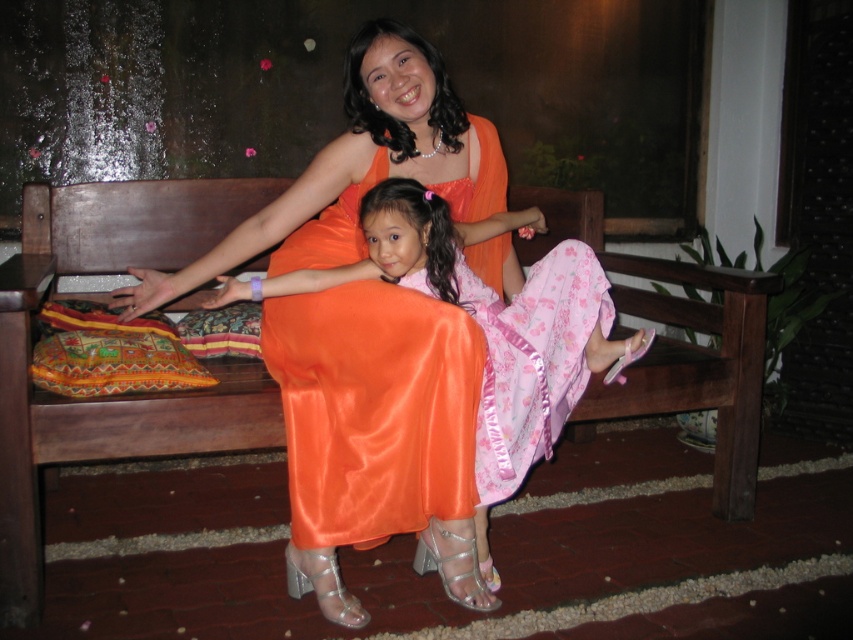
You are designing a stage for a play and need to place a prop that requires the same width as the wider object between the wooden bench at center and the shiny orange dress at center. Which object should you measure?

You should measure the wooden bench at center because it is wider than the shiny orange dress at center.

You are taking a photo of the scene and want to focus on both the point at point (x=715, y=269) and the point at point (x=456, y=337). Which point is closer to the camera?

Point (x=456, y=337) is closer to the camera than point (x=715, y=269) because the description states that point (x=715, y=269) is further away.